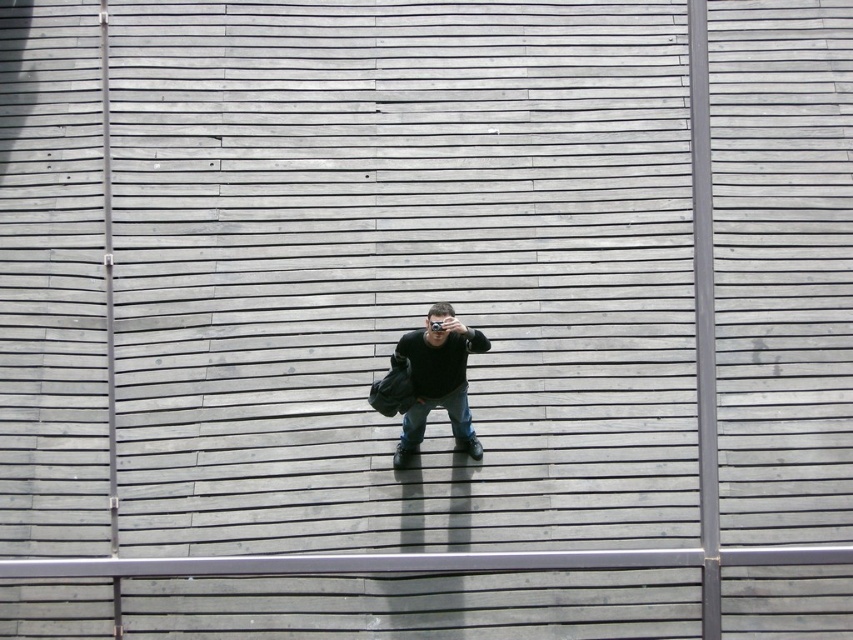
Which is behind, point (396, 355) or point (404, 435)?

The point (404, 435) is more distant.

Does point (434, 387) come behind point (412, 433)?

No, it is in front of (412, 433).

Locate an element on the screen. matte black camera at center is located at coordinates (437, 380).